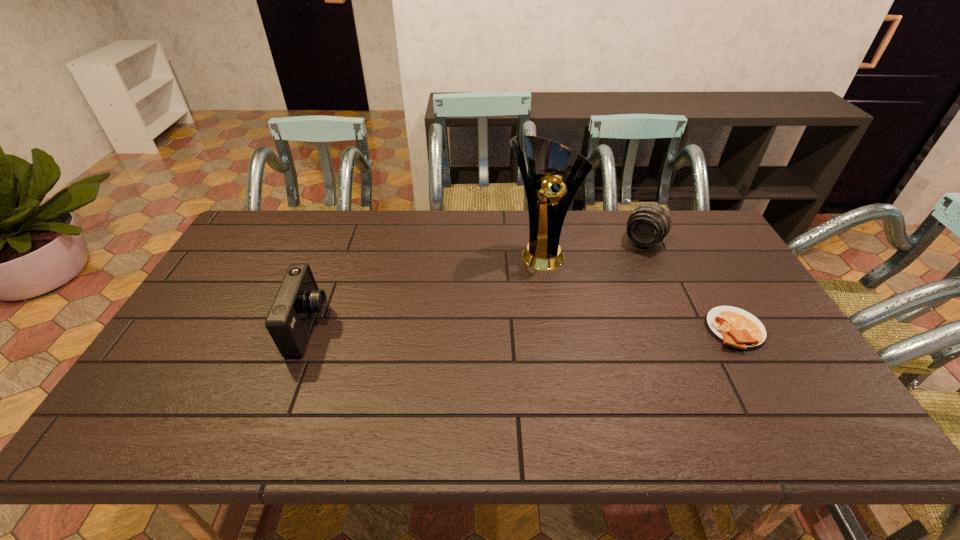
Identify the location of the leftmost object. (289, 322).

Find the location of a particular element. Image resolution: width=960 pixels, height=540 pixels. omelet is located at coordinates (732, 326).

Locate an element on the screen. Image resolution: width=960 pixels, height=540 pixels. award is located at coordinates (548, 197).

The width and height of the screenshot is (960, 540). Find the location of `the tallest object`. the tallest object is located at coordinates (548, 197).

At what (x,y) coordinates should I click in order to perform the action: click on telephoto lens. Please return your answer as a coordinate pair (x, y). The width and height of the screenshot is (960, 540). Looking at the image, I should click on (648, 224).

Find the location of a particular element. This screenshot has width=960, height=540. vacant space situated 0.260m on the front-facing side of the leftmost object is located at coordinates (422, 328).

You are a GUI agent. You are given a task and a screenshot of the screen. Output one action in this format:
    pyautogui.click(x=<x>, y=<y>)
    Task: Click on the vacant position located 0.060m on the left of the shortest object
    This screenshot has width=960, height=540.
    Given the screenshot: What is the action you would take?
    pyautogui.click(x=684, y=329)

The height and width of the screenshot is (540, 960). I want to click on free spot located at the front of the award, where the globe is visible, so (574, 324).

Where is `vacant space situated at the front of the award, where the globe is visible`? The image size is (960, 540). vacant space situated at the front of the award, where the globe is visible is located at coordinates (587, 353).

In order to click on vacant space situated 0.370m at the front of the award, where the globe is visible in this screenshot , I will do `click(592, 365)`.